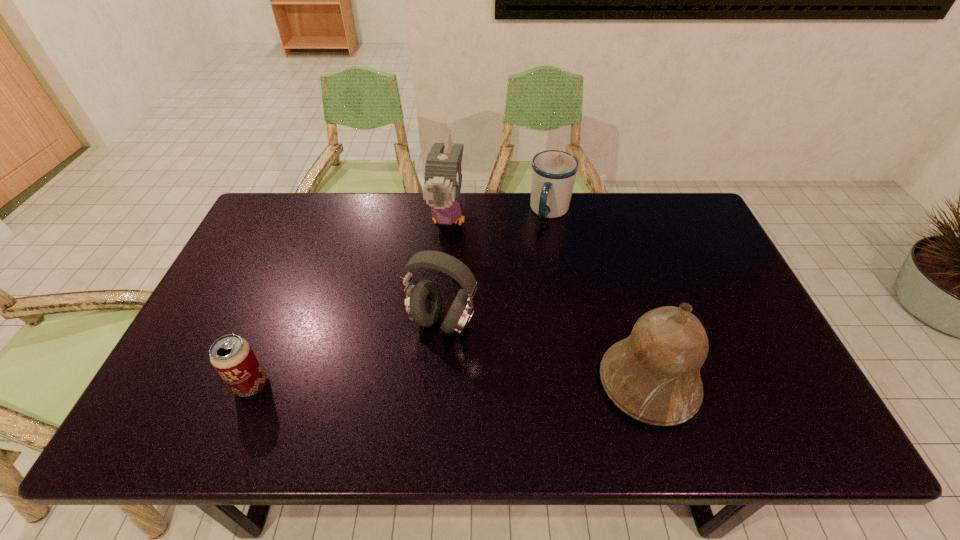
Find the location of `vacant space that satisfies the following two spatial constraints: 1. on the front side of the headset; 2. on the left side of the bird`. vacant space that satisfies the following two spatial constraints: 1. on the front side of the headset; 2. on the left side of the bird is located at coordinates (441, 322).